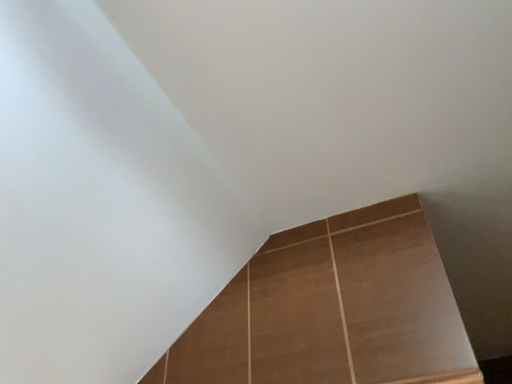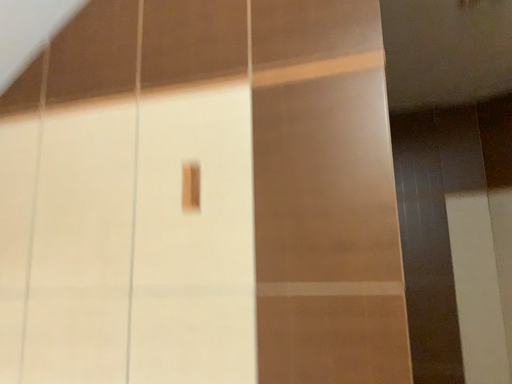
Question: How did the camera likely rotate when shooting the video?

Choices:
 (A) rotated right
 (B) rotated left

Answer: (A)